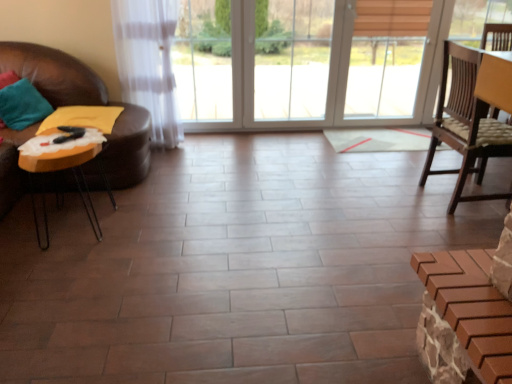
Question: Is teal fabric pillow at left at the right side of orange glossy table at left?

Choices:
 (A) yes
 (B) no

Answer: (B)

Question: Does teal fabric pillow at left have a lesser width compared to orange glossy table at left?

Choices:
 (A) yes
 (B) no

Answer: (A)

Question: Is teal fabric pillow at left facing towards orange glossy table at left?

Choices:
 (A) no
 (B) yes

Answer: (B)

Question: Is teal fabric pillow at left shorter than orange glossy table at left?

Choices:
 (A) yes
 (B) no

Answer: (A)

Question: From the image's perspective, is teal fabric pillow at left on orange glossy table at left?

Choices:
 (A) no
 (B) yes

Answer: (B)

Question: From a real-world perspective, is teal fabric pillow at left physically below orange glossy table at left?

Choices:
 (A) yes
 (B) no

Answer: (B)

Question: From a real-world perspective, is orange glossy table at left located higher than teal fabric pillow at left?

Choices:
 (A) yes
 (B) no

Answer: (B)

Question: From a real-world perspective, is orange glossy table at left beneath teal fabric pillow at left?

Choices:
 (A) yes
 (B) no

Answer: (A)

Question: Does orange glossy table at left touch teal fabric pillow at left?

Choices:
 (A) yes
 (B) no

Answer: (B)

Question: Could you tell me if orange glossy table at left is facing teal fabric pillow at left?

Choices:
 (A) no
 (B) yes

Answer: (A)

Question: Is orange glossy table at left oriented away from teal fabric pillow at left?

Choices:
 (A) no
 (B) yes

Answer: (A)

Question: Is orange glossy table at left positioned behind teal fabric pillow at left?

Choices:
 (A) yes
 (B) no

Answer: (B)

Question: Is teal fabric pillow at left wider or thinner than orange glossy table at left?

Choices:
 (A) thin
 (B) wide

Answer: (A)